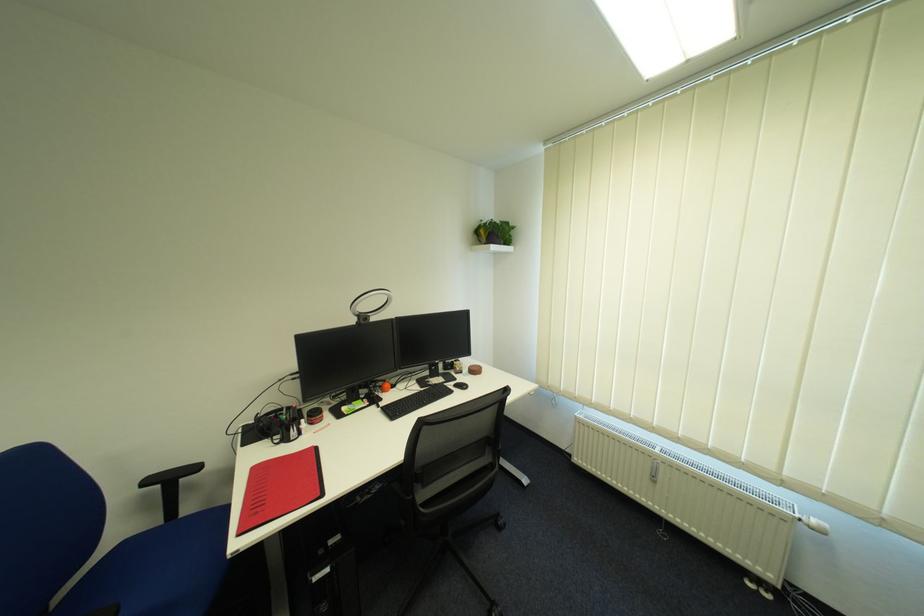
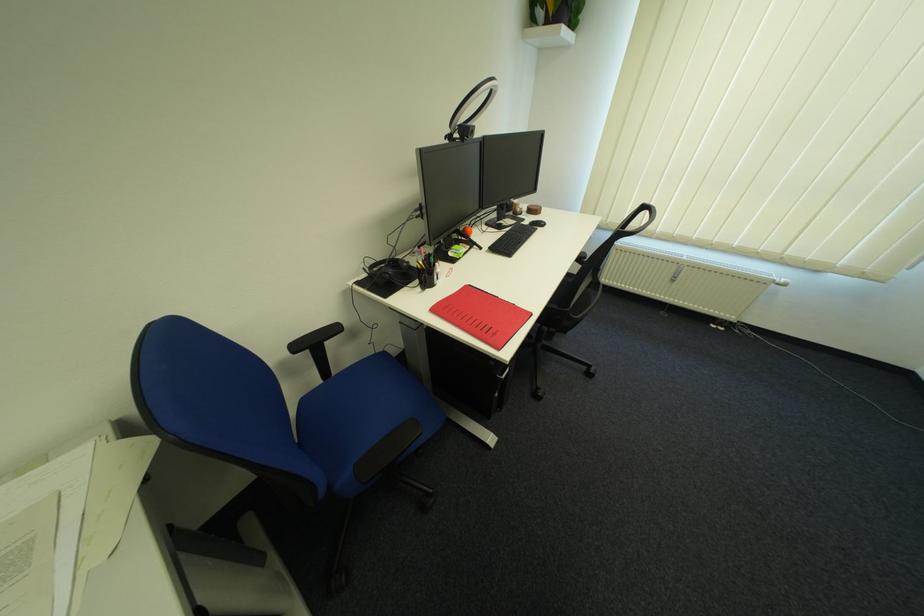
In the second image, find the point that corresponds to point 378,405 in the first image.

(479, 248)